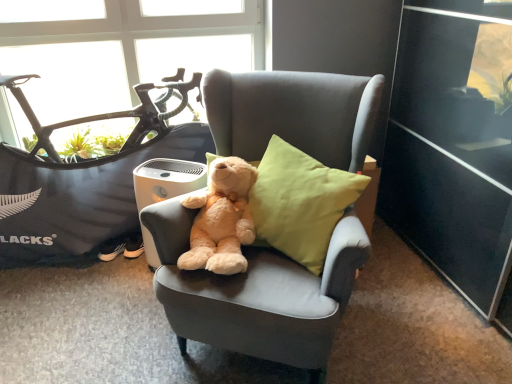
Question: In which direction should I rotate to look at linen cushion at center, the second pillow positioned from the left?

Choices:
 (A) left
 (B) right

Answer: (B)

Question: From the image's perspective, is black matte mountain bike at left located beneath soft gray fabric chair at center?

Choices:
 (A) no
 (B) yes

Answer: (A)

Question: Can you confirm if black matte mountain bike at left is taller than soft gray fabric chair at center?

Choices:
 (A) yes
 (B) no

Answer: (B)

Question: Does black matte mountain bike at left turn towards soft gray fabric chair at center?

Choices:
 (A) no
 (B) yes

Answer: (B)

Question: Is soft gray fabric chair at center a part of black matte mountain bike at left?

Choices:
 (A) yes
 (B) no

Answer: (B)

Question: Does black matte mountain bike at left have a smaller size compared to soft gray fabric chair at center?

Choices:
 (A) no
 (B) yes

Answer: (B)

Question: From the image's perspective, is black matte mountain bike at left on soft gray fabric chair at center?

Choices:
 (A) yes
 (B) no

Answer: (A)

Question: Is light brown plush teddy bear at center not close to linen-like green pillow at center, placed as the 2th pillow when sorted from right to left?

Choices:
 (A) yes
 (B) no

Answer: (B)

Question: Is light brown plush teddy bear at center taller than linen-like green pillow at center, placed as the 2th pillow when sorted from right to left?

Choices:
 (A) yes
 (B) no

Answer: (B)

Question: Does light brown plush teddy bear at center have a greater width compared to linen-like green pillow at center, which is counted as the 1th pillow, starting from the left?

Choices:
 (A) no
 (B) yes

Answer: (B)

Question: Does light brown plush teddy bear at center appear on the left side of linen-like green pillow at center, placed as the 2th pillow when sorted from right to left?

Choices:
 (A) yes
 (B) no

Answer: (A)

Question: From a real-world perspective, does light brown plush teddy bear at center sit lower than linen-like green pillow at center, which is counted as the 1th pillow, starting from the left?

Choices:
 (A) yes
 (B) no

Answer: (B)

Question: Can you confirm if light brown plush teddy bear at center is smaller than linen-like green pillow at center, placed as the 2th pillow when sorted from right to left?

Choices:
 (A) no
 (B) yes

Answer: (A)

Question: Is light brown plush teddy bear at center next to transparent glass window at upper left and touching it?

Choices:
 (A) no
 (B) yes

Answer: (A)